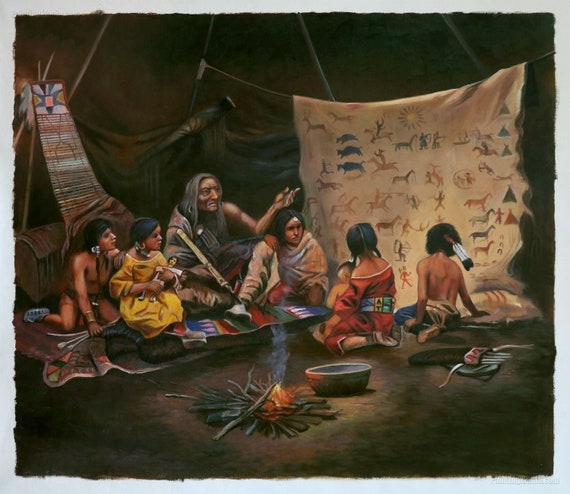
At what (x,y) coordinates should I click in order to perform the action: click on basket. Please return your answer as a coordinate pair (x, y). The image size is (570, 494). Looking at the image, I should click on (347, 369).